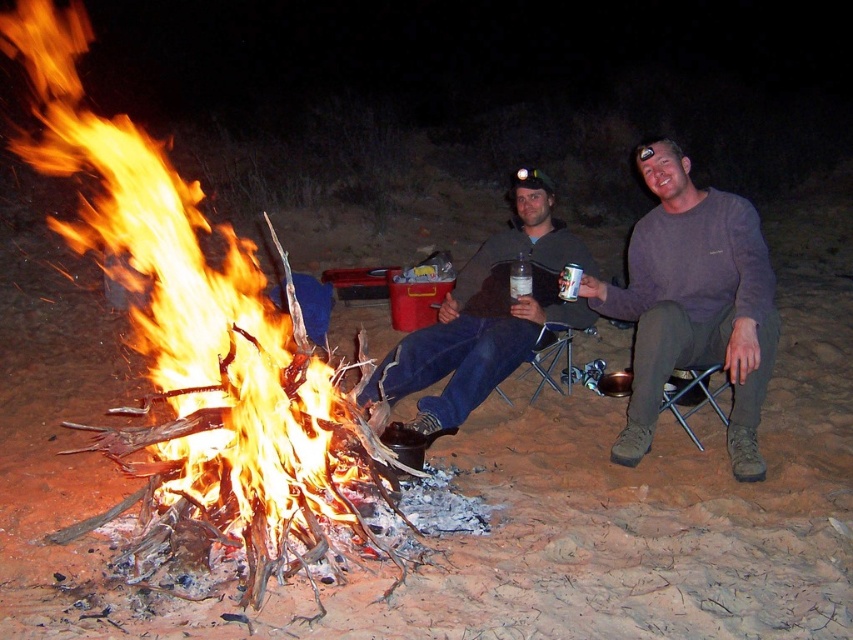
Question: Can you confirm if purple sweater at center is positioned to the right of metallic silver can at center?

Choices:
 (A) yes
 (B) no

Answer: (A)

Question: From the image, what is the correct spatial relationship of purple sweater at center in relation to matte black jacket at center?

Choices:
 (A) left
 (B) right

Answer: (B)

Question: Which of the following is the closest to the observer?

Choices:
 (A) (1, 49)
 (B) (634, 336)
 (C) (572, 294)
 (D) (514, 356)

Answer: (C)

Question: Which of the following is the farthest from the observer?

Choices:
 (A) (363, 529)
 (B) (726, 260)
 (C) (616, 460)
 (D) (422, 413)

Answer: (D)

Question: Based on their relative distances, which object is nearer to the flaming wood fire at left?

Choices:
 (A) matte black jacket at center
 (B) metallic silver can at center

Answer: (A)

Question: Can you confirm if matte gray sweater at center is thinner than metallic silver can at center?

Choices:
 (A) no
 (B) yes

Answer: (A)